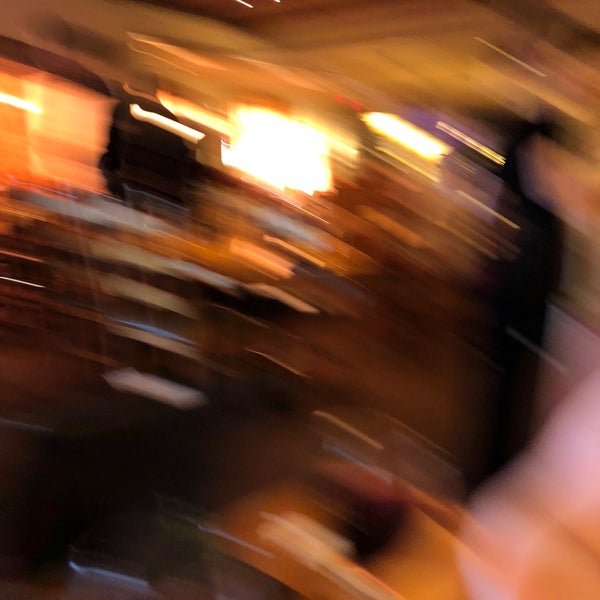
Image resolution: width=600 pixels, height=600 pixels. What are the coordinates of `white bar` in the screenshot? It's located at (23, 105).